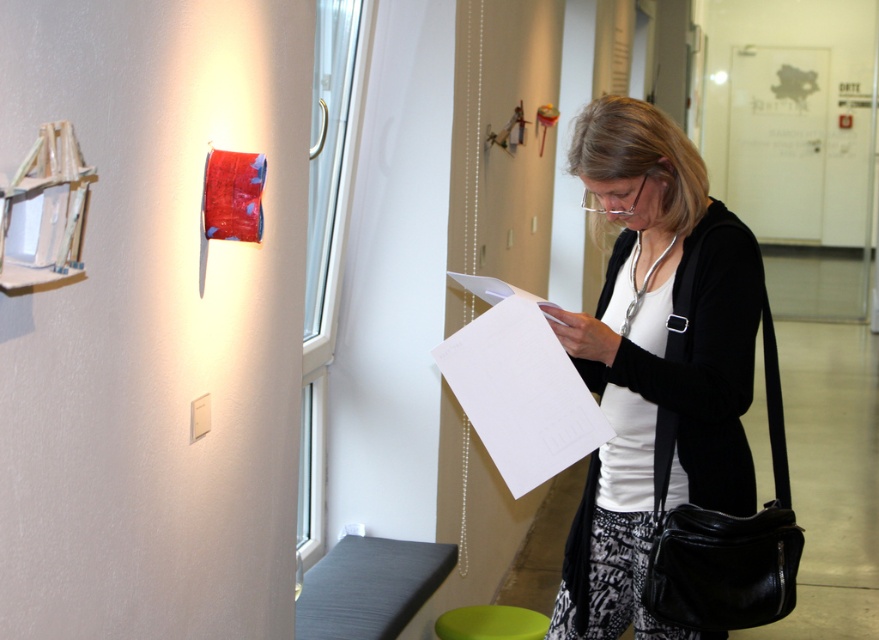
Question: Does white matte paper at center come in front of green fabric stool at lower center?

Choices:
 (A) yes
 (B) no

Answer: (A)

Question: Which object is the closest to the green fabric stool at lower center?

Choices:
 (A) white matte paper at center
 (B) white paper at center

Answer: (A)

Question: Does white matte paper at center have a greater width compared to green fabric stool at lower center?

Choices:
 (A) yes
 (B) no

Answer: (A)

Question: Which point is farther from the camera taking this photo?

Choices:
 (A) (634, 339)
 (B) (505, 632)
 (C) (534, 406)

Answer: (B)

Question: Based on their relative distances, which object is farther from the green fabric stool at lower center?

Choices:
 (A) white matte paper at center
 (B) white paper at center

Answer: (B)

Question: Can you confirm if white paper at center is positioned to the right of green fabric stool at lower center?

Choices:
 (A) yes
 (B) no

Answer: (A)